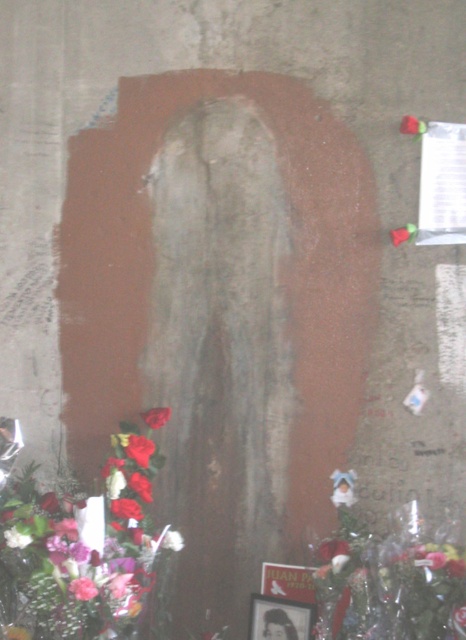
You are an interior designer arranging flowers in front of a niche. You have two types of roses here, the smooth glossy roses at lower left and the red matte rose at lower left. Which one is positioned lower in the arrangement?

The smooth glossy roses at lower left is located below the red matte rose at lower left, so it is positioned lower in the arrangement.